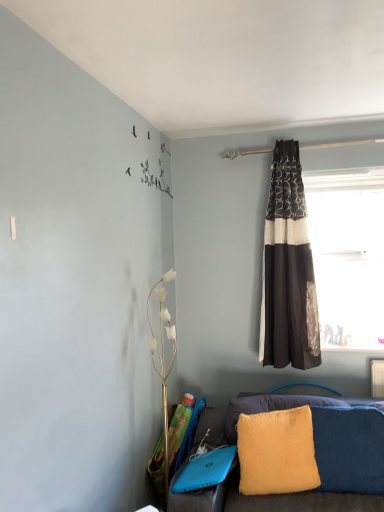
Question: Is black textured curtain at right at the left side of fuzzy yellow pillow at lower right?

Choices:
 (A) no
 (B) yes

Answer: (A)

Question: Can you confirm if black textured curtain at right is shorter than fuzzy yellow pillow at lower right?

Choices:
 (A) no
 (B) yes

Answer: (A)

Question: From the image's perspective, is black textured curtain at right below fuzzy yellow pillow at lower right?

Choices:
 (A) no
 (B) yes

Answer: (A)

Question: Could fuzzy yellow pillow at lower right be considered to be inside black textured curtain at right?

Choices:
 (A) no
 (B) yes

Answer: (A)

Question: From a real-world perspective, is black textured curtain at right located beneath fuzzy yellow pillow at lower right?

Choices:
 (A) no
 (B) yes

Answer: (A)

Question: Is black textured curtain at right smaller than fuzzy yellow pillow at lower right?

Choices:
 (A) yes
 (B) no

Answer: (B)

Question: Is transparent glass window at upper right positioned behind fuzzy yellow pillow at lower right?

Choices:
 (A) yes
 (B) no

Answer: (A)

Question: Considering the relative positions of transparent glass window at upper right and fuzzy yellow pillow at lower right in the image provided, is transparent glass window at upper right to the left of fuzzy yellow pillow at lower right from the viewer's perspective?

Choices:
 (A) no
 (B) yes

Answer: (A)

Question: From the image's perspective, is transparent glass window at upper right located beneath fuzzy yellow pillow at lower right?

Choices:
 (A) yes
 (B) no

Answer: (B)

Question: From a real-world perspective, is transparent glass window at upper right physically below fuzzy yellow pillow at lower right?

Choices:
 (A) yes
 (B) no

Answer: (B)

Question: Is transparent glass window at upper right positioned beyond the bounds of fuzzy yellow pillow at lower right?

Choices:
 (A) yes
 (B) no

Answer: (A)

Question: Is the depth of transparent glass window at upper right less than that of fuzzy yellow pillow at lower right?

Choices:
 (A) no
 (B) yes

Answer: (A)

Question: From a real-world perspective, is fuzzy yellow pillow at lower right on top of transparent glass window at upper right?

Choices:
 (A) no
 (B) yes

Answer: (A)